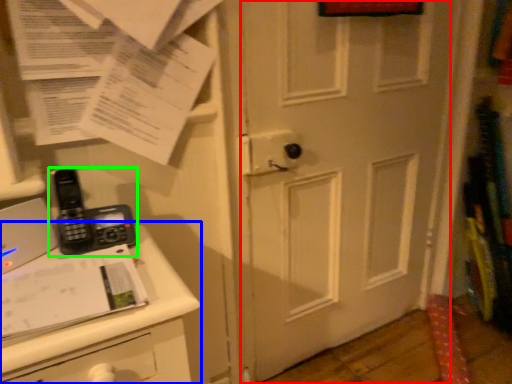
Question: Based on their relative distances, which object is farther from door (highlighted by a red box)? Choose from changing table (highlighted by a blue box) and corded phone (highlighted by a green box).

Choices:
 (A) changing table
 (B) corded phone

Answer: (B)